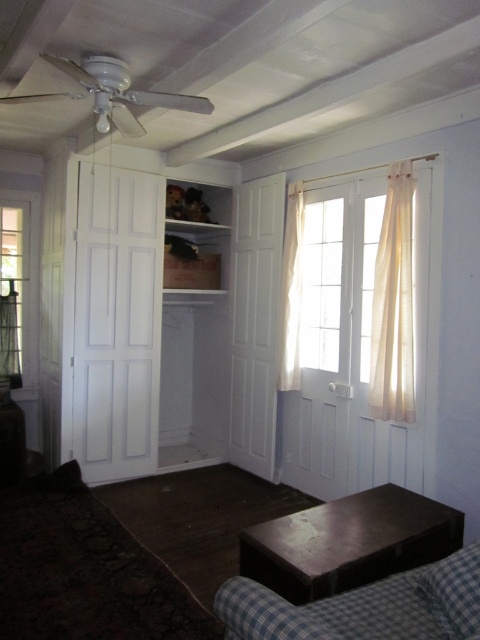
You are standing in the room and want to move from the ceiling fan to the built in closet. Which point, point [268,612] or point [395,259], is closer to your starting position at the ceiling fan?

Point [268,612] is closer to the ceiling fan because it is in front of point [395,259].

You are sitting on a sofa in the cozy corner of the room and want to reach the shiny dark wood coffee table at lower right. However, there is an ivory sheer curtain at right in your way. Can you move around the curtain to access the coffee table?

The shiny dark wood coffee table at lower right is positioned under the ivory sheer curtain at right, so you can easily move around the curtain to access the coffee table since it is located beneath it.